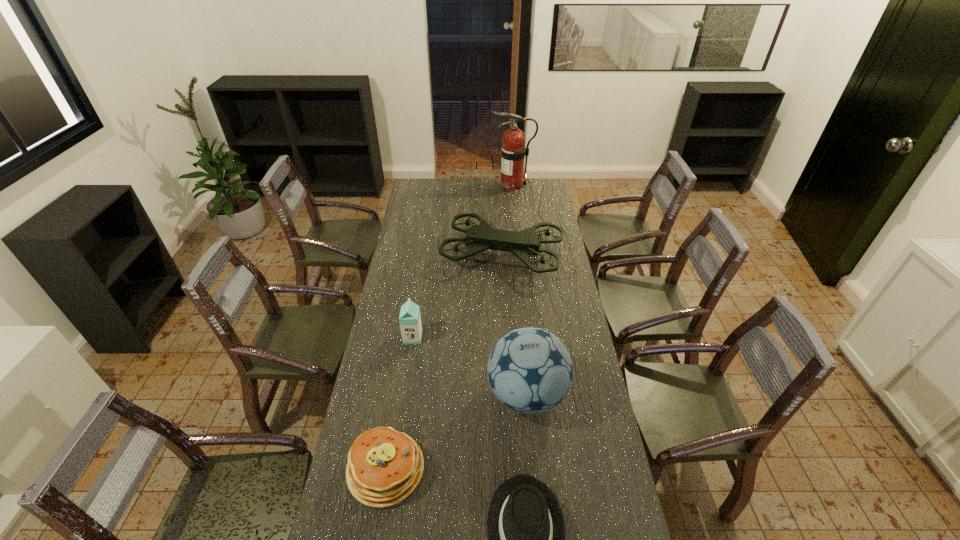
Find the location of a particular element. The image size is (960, 540). the tallest object is located at coordinates (513, 151).

Find the location of a particular element. fire extinguisher is located at coordinates (513, 151).

Identify the location of the fifth nearest object. (523, 244).

Where is `the fourth farthest object`? Image resolution: width=960 pixels, height=540 pixels. the fourth farthest object is located at coordinates point(529,370).

Image resolution: width=960 pixels, height=540 pixels. Find the location of `milk carton`. milk carton is located at coordinates (410, 319).

At what (x,y) coordinates should I click in order to perform the action: click on the fourth nearest object. Please return your answer as a coordinate pair (x, y). This screenshot has width=960, height=540. Looking at the image, I should click on (410, 319).

The height and width of the screenshot is (540, 960). Identify the location of pancake. (384, 466).

Identify the location of vacant area situated 0.390m at the nozzle of the tallest object. (425, 185).

Identify the location of free region located at the nozzle of the tallest object. click(x=432, y=185).

This screenshot has width=960, height=540. What are the coordinates of `free location located 0.070m at the nozzle of the tallest object` in the screenshot? It's located at (478, 185).